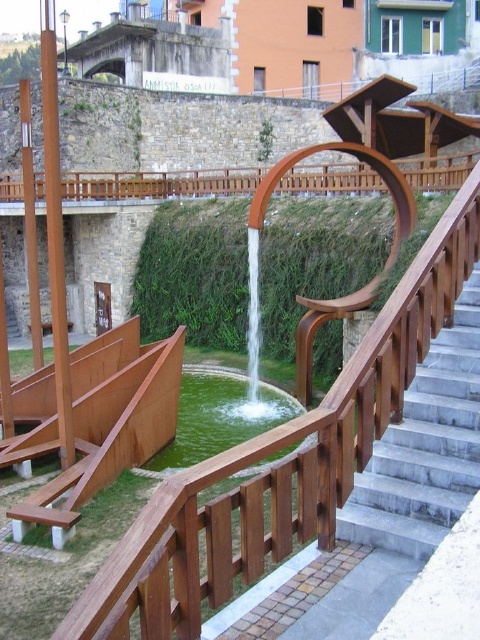
Between smooth gray concrete stairs at right and green liquid water at center, which one appears on the right side from the viewer's perspective?

smooth gray concrete stairs at right

Does smooth gray concrete stairs at right have a larger size compared to green liquid water at center?

No, smooth gray concrete stairs at right is not bigger than green liquid water at center.

Does point (409, 435) come farther from viewer compared to point (189, 451)?

No, (409, 435) is in front of (189, 451).

In order to click on smooth gray concrete stairs at right in this screenshot , I will do `click(424, 448)`.